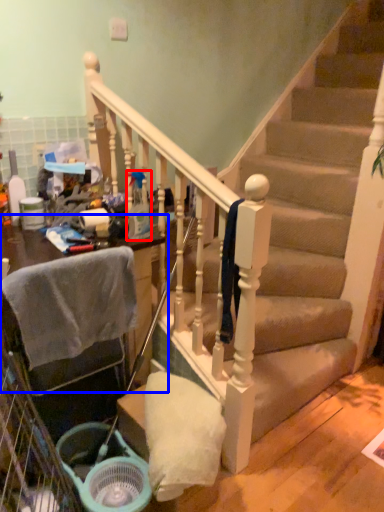
Question: Among these objects, which one is farthest to the camera, bottle (highlighted by a red box) or furniture (highlighted by a blue box)?

Choices:
 (A) bottle
 (B) furniture

Answer: (A)